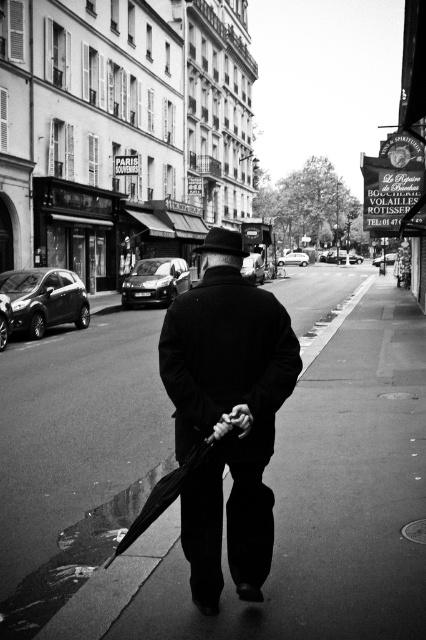
You are a delivery person who needs to place a package on the smooth asphalt sidewalk at center while holding the black matte umbrella at center. Can you place the package on the sidewalk without bending down?

The smooth asphalt sidewalk at center is much taller than the black matte umbrella at center. Since the sidewalk is elevated higher, you would need to bend down to place the package on it.

You are a delivery person who needs to walk on the smooth asphalt sidewalk at center while carrying a large package. Can you also hold the black matte umbrella at center without it extending beyond the sidewalk?

The smooth asphalt sidewalk at center is bigger than the black matte umbrella at center, so yes, you can hold the black matte umbrella at center without it extending beyond the sidewalk.